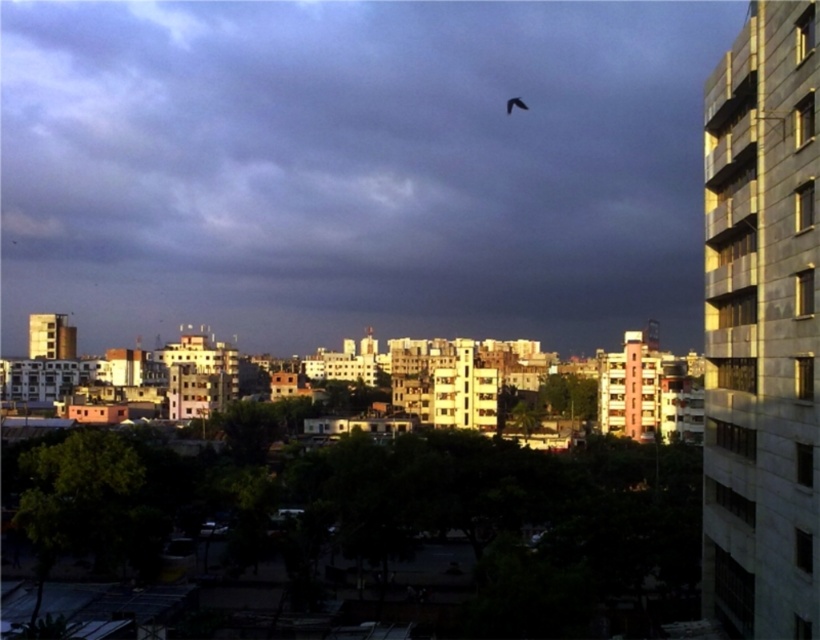
In the scene shown: You are a drone operator who needs to deliver a package from the dark gray cloud at upper center to a location 300 meters away. Can you safely make the delivery without exceeding the distance limit?

The dark gray cloud at upper center is 352.08 meters away. Since the required distance is 300 meters, the delivery cannot be made safely as it exceeds the limit.